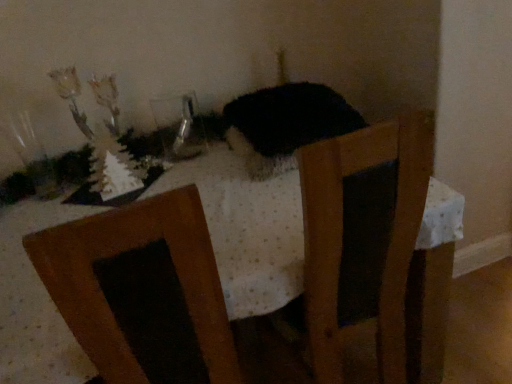
Question: Can you confirm if white dotted fabric at center is bigger than fuzzy black cat at center?

Choices:
 (A) no
 (B) yes

Answer: (B)

Question: Considering the relative sizes of white dotted fabric at center and fuzzy black cat at center in the image provided, is white dotted fabric at center taller than fuzzy black cat at center?

Choices:
 (A) yes
 (B) no

Answer: (A)

Question: Is white dotted fabric at center outside of fuzzy black cat at center?

Choices:
 (A) no
 (B) yes

Answer: (B)

Question: Does white dotted fabric at center come in front of fuzzy black cat at center?

Choices:
 (A) yes
 (B) no

Answer: (A)

Question: Does white dotted fabric at center appear on the left side of fuzzy black cat at center?

Choices:
 (A) yes
 (B) no

Answer: (A)

Question: From the image's perspective, is white dotted fabric at center positioned above or below transparent glass vase at upper left?

Choices:
 (A) below
 (B) above

Answer: (A)

Question: Is white dotted fabric at center wider or thinner than transparent glass vase at upper left?

Choices:
 (A) wide
 (B) thin

Answer: (A)

Question: Choose the correct answer: Is white dotted fabric at center inside transparent glass vase at upper left or outside it?

Choices:
 (A) outside
 (B) inside

Answer: (A)

Question: Based on their sizes in the image, would you say white dotted fabric at center is bigger or smaller than transparent glass vase at upper left?

Choices:
 (A) small
 (B) big

Answer: (B)

Question: Looking at their shapes, would you say transparent glass vase at upper left is wider or thinner than white dotted fabric at center?

Choices:
 (A) wide
 (B) thin

Answer: (B)

Question: Based on their sizes in the image, would you say transparent glass vase at upper left is bigger or smaller than white dotted fabric at center?

Choices:
 (A) big
 (B) small

Answer: (B)

Question: Is transparent glass vase at upper left inside the boundaries of white dotted fabric at center, or outside?

Choices:
 (A) outside
 (B) inside

Answer: (A)

Question: From the image's perspective, is transparent glass vase at upper left above or below white dotted fabric at center?

Choices:
 (A) above
 (B) below

Answer: (A)

Question: Does point (163, 100) appear closer or farther from the camera than point (329, 87)?

Choices:
 (A) closer
 (B) farther

Answer: (B)

Question: Considering the positions of transparent glass vase at upper left and fuzzy black cat at center in the image, is transparent glass vase at upper left bigger or smaller than fuzzy black cat at center?

Choices:
 (A) big
 (B) small

Answer: (B)